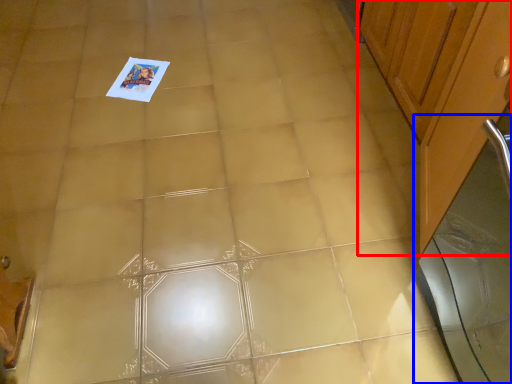
Question: Which object is further to the camera taking this photo, cabinetry (highlighted by a red box) or screen door (highlighted by a blue box)?

Choices:
 (A) cabinetry
 (B) screen door

Answer: (A)